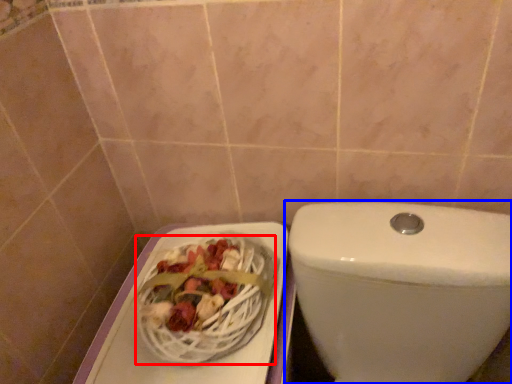
Question: Among these objects, which one is farthest to the camera, basket (highlighted by a red box) or toilet (highlighted by a blue box)?

Choices:
 (A) basket
 (B) toilet

Answer: (A)